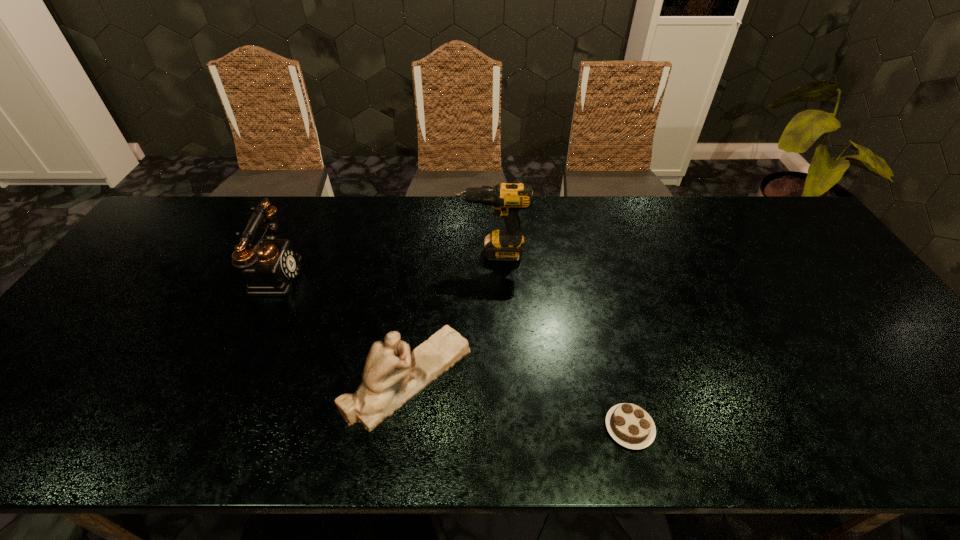
You are a GUI agent. You are given a task and a screenshot of the screen. Output one action in this format:
    pyautogui.click(x=<x>, y=<y>)
    Task: Click on the free spot that satisfies the following two spatial constraints: 1. on the front-facing side of the figurine; 2. on the right side of the chocolate cake
    The width and height of the screenshot is (960, 540).
    Given the screenshot: What is the action you would take?
    pyautogui.click(x=402, y=428)

This screenshot has width=960, height=540. In order to click on free space that satisfies the following two spatial constraints: 1. on the front-facing side of the shortest object; 2. on the left side of the second shortest object in this screenshot , I will do `click(402, 428)`.

I want to click on blank area in the image that satisfies the following two spatial constraints: 1. on the front-facing side of the figurine; 2. on the left side of the chocolate cake, so click(402, 428).

Image resolution: width=960 pixels, height=540 pixels. In order to click on vacant area that satisfies the following two spatial constraints: 1. on the back side of the rightmost object; 2. on the front-facing side of the second shortest object in this screenshot , I will do `click(617, 377)`.

Find the location of a particular element. Image resolution: width=960 pixels, height=540 pixels. free point that satisfies the following two spatial constraints: 1. on the back side of the chocolate cake; 2. at the tip of the tallest object is located at coordinates (586, 253).

I want to click on free space that satisfies the following two spatial constraints: 1. on the front of the chocolate cake at the rotary dial; 2. on the right side of the second tallest object, so click(200, 428).